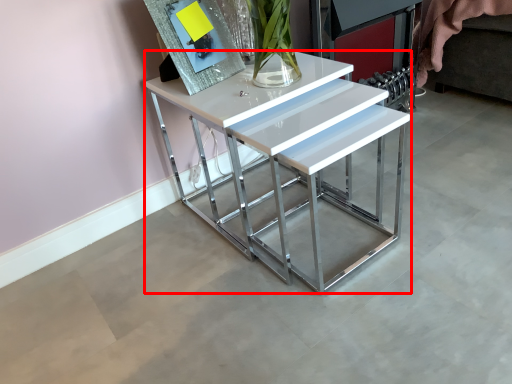
Question: In this image, where is table (annotated by the red box) located relative to picture frame?

Choices:
 (A) right
 (B) left

Answer: (A)